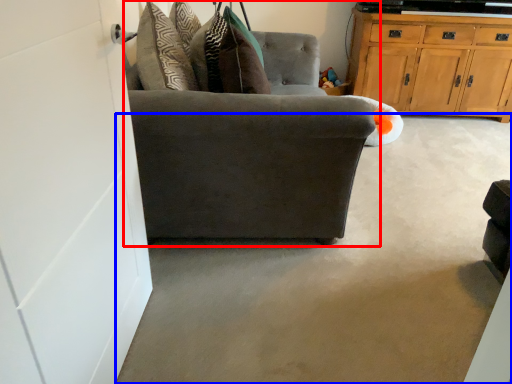
Question: Among these objects, which one is farthest to the camera, chair (highlighted by a red box) or concrete (highlighted by a blue box)?

Choices:
 (A) chair
 (B) concrete

Answer: (A)